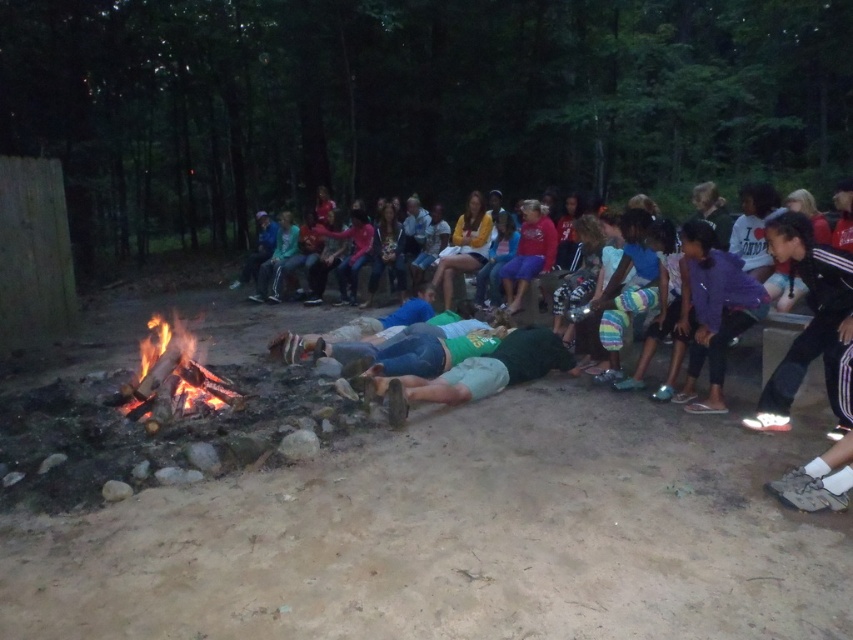
Question: Does green fabric shirt at center have a smaller size compared to flaming wood fire at center?

Choices:
 (A) no
 (B) yes

Answer: (A)

Question: Among these objects, which one is farthest from the camera?

Choices:
 (A) green fabric shirt at center
 (B) flaming wood fire at center

Answer: (B)

Question: Is green fabric shirt at center below flaming wood fire at center?

Choices:
 (A) yes
 (B) no

Answer: (B)

Question: Which of the following is the farthest from the observer?

Choices:
 (A) (849, 406)
 (B) (126, 406)

Answer: (B)

Question: Does green fabric shirt at center appear under flaming wood fire at center?

Choices:
 (A) no
 (B) yes

Answer: (A)